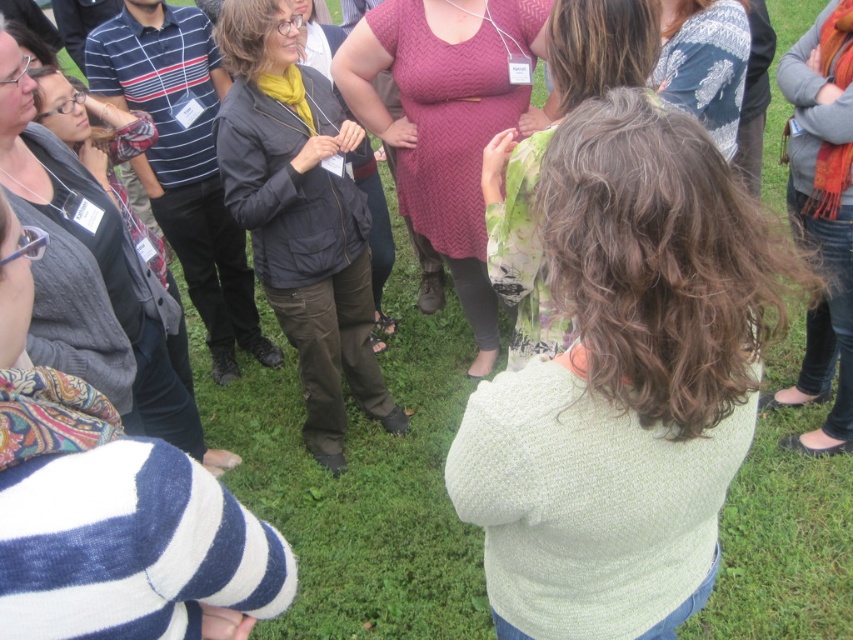
You are standing at the center of the grassy area and want to move towards the jeans at lower right. Based on their position, in which general direction should you walk?

The jeans at lower right are located at coordinates approximately 0.338 on the x axis and 0.965 on the y axis. Since the lower right corner of the image corresponds to higher x and y values, you should walk towards the lower right direction to reach them.

From the picture: You are standing at point (724,141) and want to move to the front of the group. Is the point (839,264) in front of or behind you?

Point (839,264) is in front of point (724,141), so it is in front of you.

You are standing in the middle of the group and want to move towards the person with the colorful patterned bag. Which direction should you go to reach them first, towards point (291, 132) or point (711, 12)?

You should move towards point (291, 132) because it is closer to you than point (711, 12), which is further away.